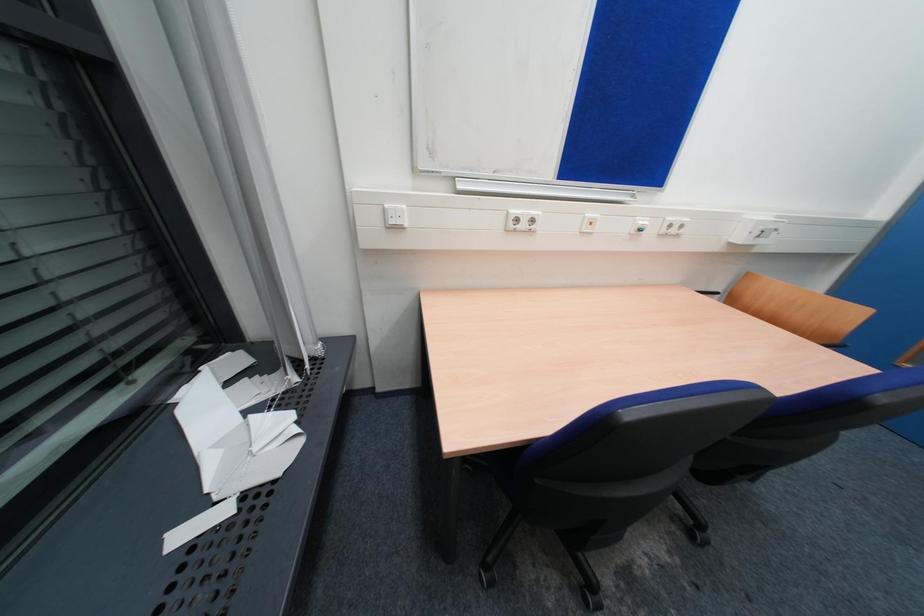
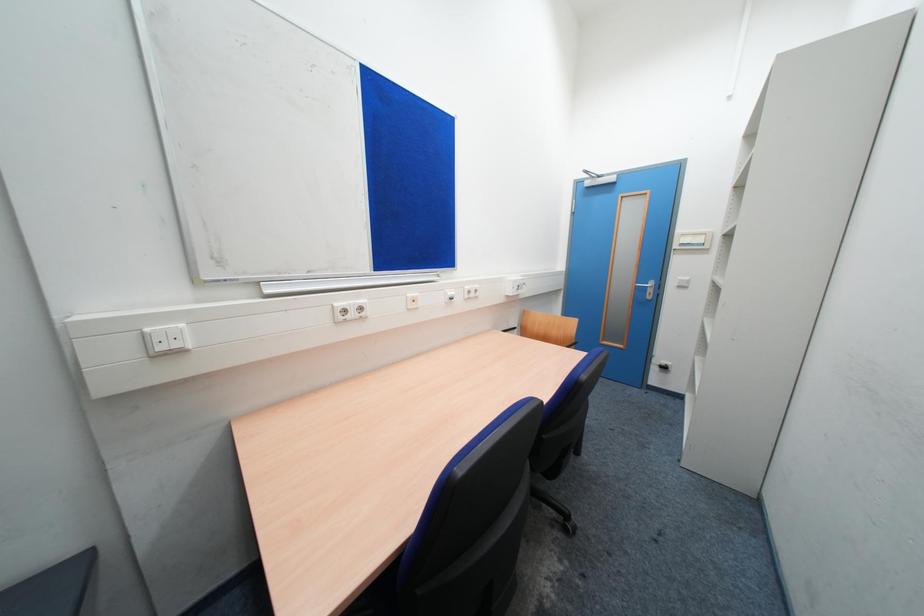
Question: The camera is either moving clockwise (left) or counter-clockwise (right) around the object. The first image is from the beginning of the video and the second image is from the end. Is the camera moving left or right when shooting the video?

Choices:
 (A) Left
 (B) Right

Answer: (A)